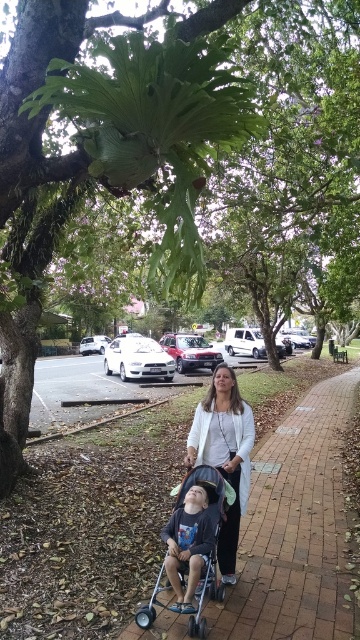
Question: Considering the real-world distances, which object is closest to the dark gray fabric stroller at lower center?

Choices:
 (A) metallic blue stroller at center
 (B) brick pavement at center
 (C) white matte jacket at center

Answer: (A)

Question: Based on their relative distances, which object is nearer to the brick pavement at center?

Choices:
 (A) dark gray fabric stroller at lower center
 (B) white matte jacket at center
 (C) metallic blue stroller at center

Answer: (C)

Question: Which point is closer to the camera?

Choices:
 (A) brick pavement at center
 (B) dark gray fabric stroller at lower center

Answer: (B)

Question: Does white matte jacket at center have a lesser width compared to metallic blue stroller at center?

Choices:
 (A) no
 (B) yes

Answer: (B)

Question: Does brick pavement at center have a lesser width compared to dark gray fabric stroller at lower center?

Choices:
 (A) yes
 (B) no

Answer: (B)

Question: Can you confirm if white matte jacket at center is positioned above dark gray fabric stroller at lower center?

Choices:
 (A) no
 (B) yes

Answer: (B)